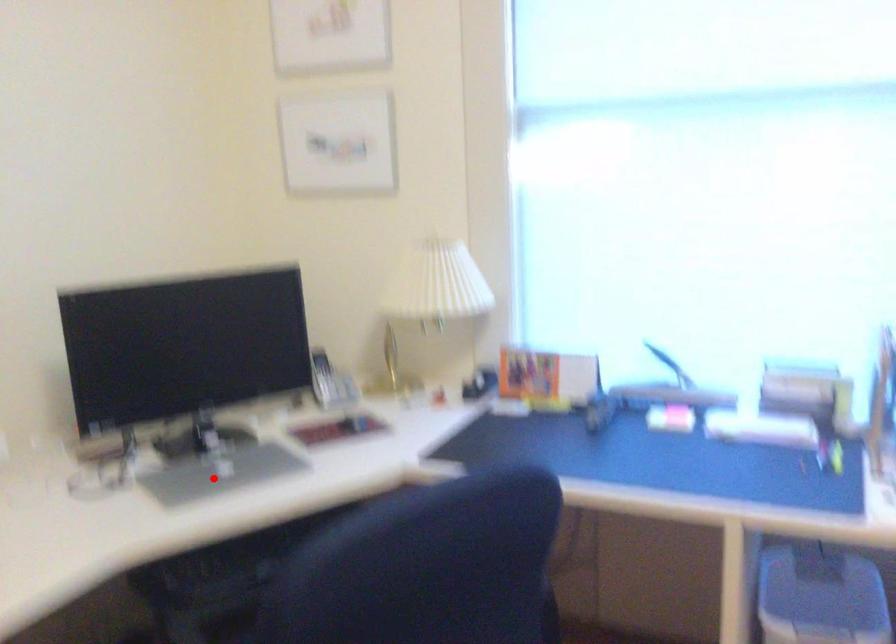
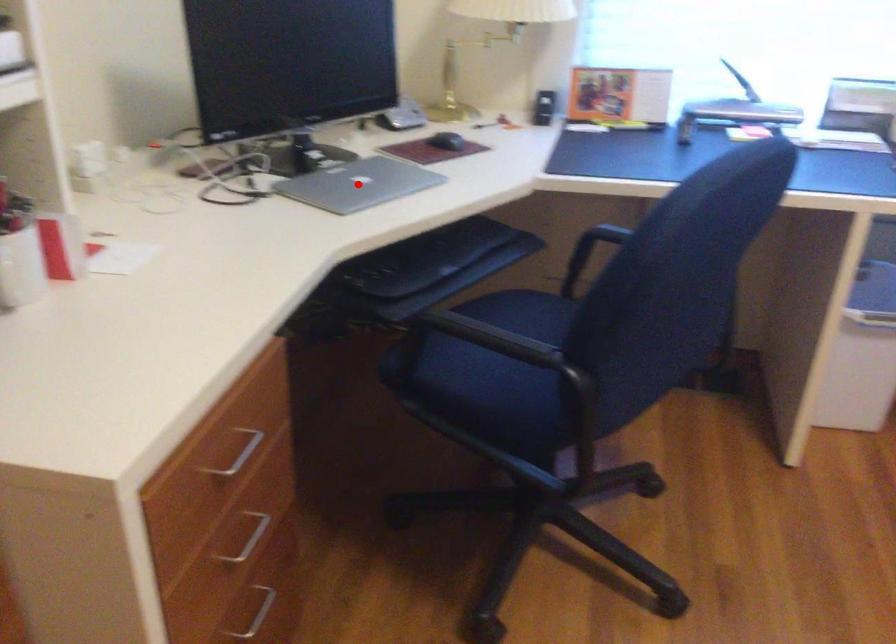
I am providing you with two images of the same scene from different viewpoints. A red point is marked on the first image and another point is marked on the second image. Is the red point in image1 aligned with the point shown in image2?

Yes